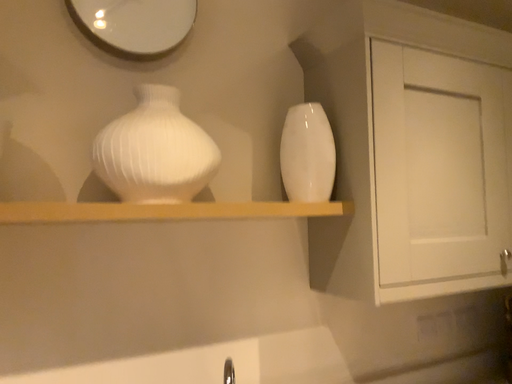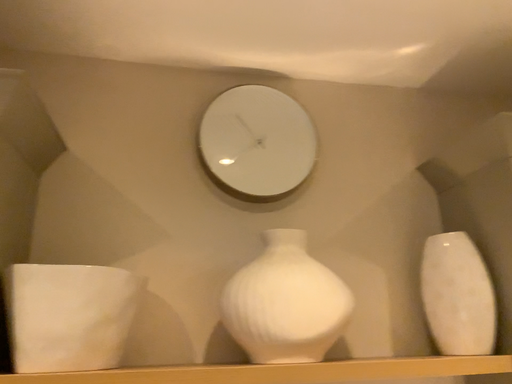
Question: Which way did the camera rotate in the video?

Choices:
 (A) rotated left
 (B) rotated right

Answer: (A)